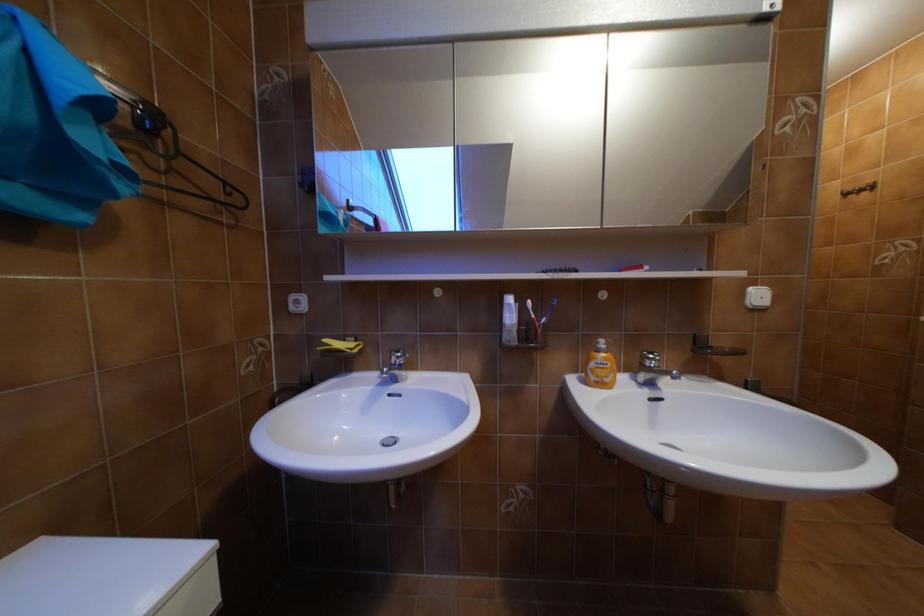
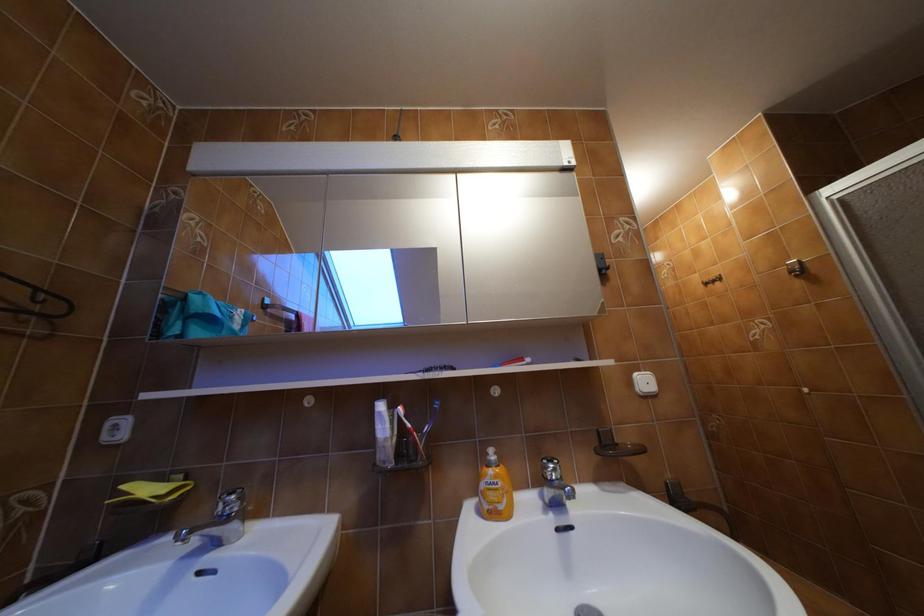
Question: The images are taken continuously from a first-person perspective. In which direction are you moving?

Choices:
 (A) Left
 (B) Right
 (C) Forward
 (D) Backward

Answer: (B)